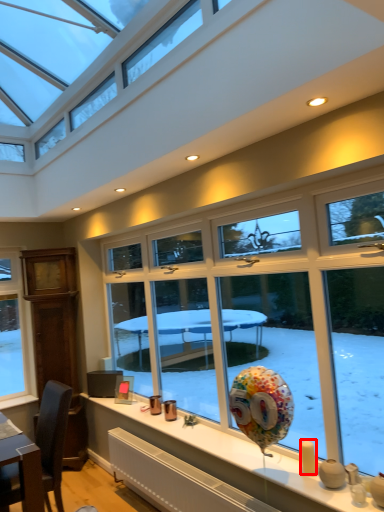
Question: From the image's perspective, what is the correct spatial positioning of candle (annotated by the red box) in reference to candle holder?

Choices:
 (A) below
 (B) above

Answer: (B)